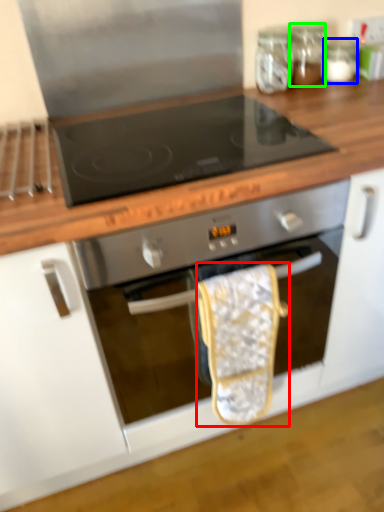
Question: Which is nearer to the material (highlighted by a red box)? glass jar (highlighted by a blue box) or glass jar (highlighted by a green box).

Choices:
 (A) glass jar
 (B) glass jar

Answer: (B)